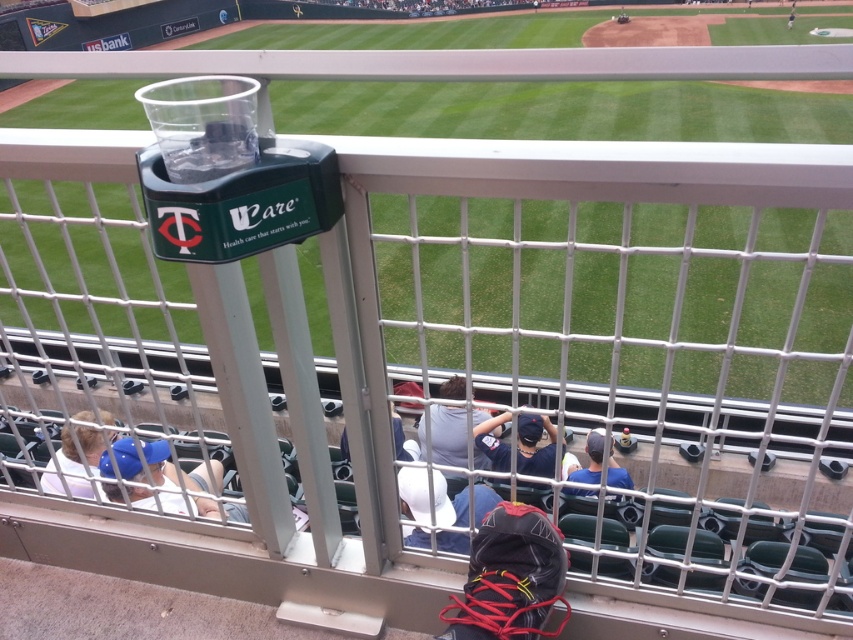
Does matte gray shirt at center appear on the right side of white fabric cap at lower left?

Correct, you'll find matte gray shirt at center to the right of white fabric cap at lower left.

Between matte gray shirt at center and white fabric cap at lower left, which one appears on the right side from the viewer's perspective?

matte gray shirt at center

Is point (488, 417) in front of point (83, 412)?

Yes, it is.

The image size is (853, 640). Identify the location of matte gray shirt at center. (448, 435).

Which is more to the right, black fabric backpack at lower center or dark blue baseball cap at center?

dark blue baseball cap at center is more to the right.

Does point (498, 554) come farther from viewer compared to point (538, 468)?

No.

Where is `black fabric backpack at lower center`? This screenshot has width=853, height=640. black fabric backpack at lower center is located at coordinates (509, 577).

Who is shorter, matte gray shirt at center or blue fabric cap at center?

blue fabric cap at center is shorter.

Is matte gray shirt at center smaller than blue fabric cap at center?

Incorrect, matte gray shirt at center is not smaller in size than blue fabric cap at center.

Between point (453, 378) and point (611, 481), which one is positioned in front?

Point (611, 481) is in front.

I want to click on matte gray shirt at center, so click(x=448, y=435).